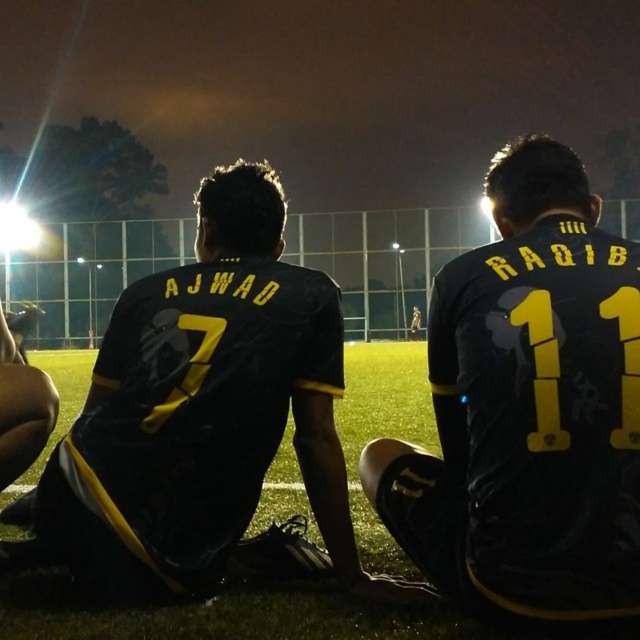
Is black matte jersey at center thinner than matte black jersey at left?

Yes, black matte jersey at center is thinner than matte black jersey at left.

Find the location of `black matte jersey at center`. black matte jersey at center is located at coordinates (529, 412).